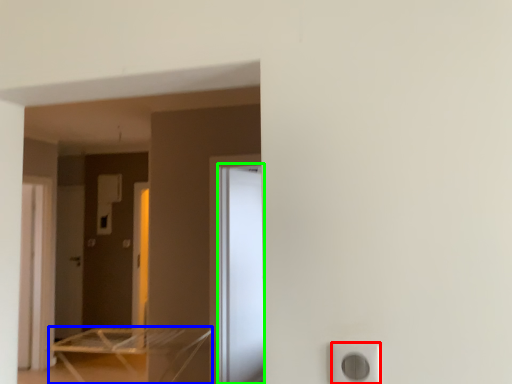
Question: Considering the real-world distances, which object is farthest from electric outlet (highlighted by a red box)? furniture (highlighted by a blue box) or screen door (highlighted by a green box)?

Choices:
 (A) furniture
 (B) screen door

Answer: (A)